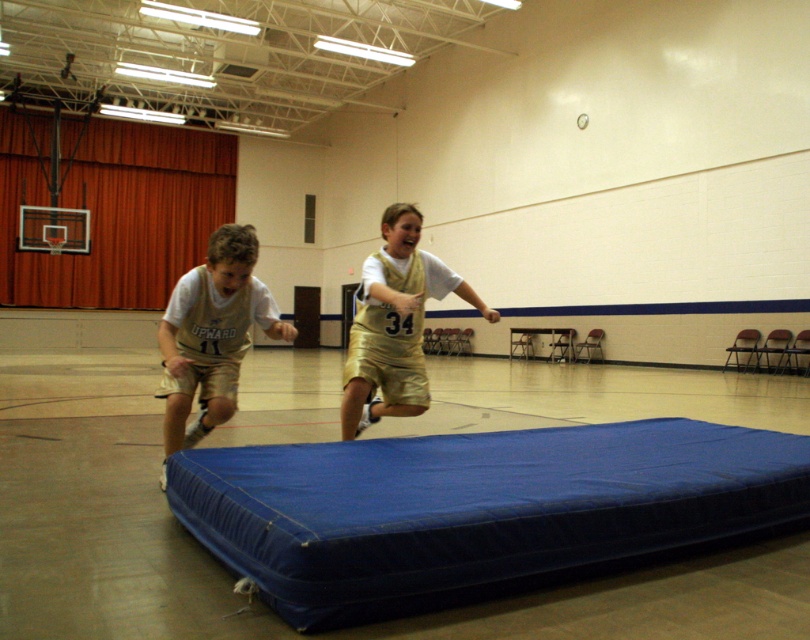
Question: Which of the following is the closest to the observer?

Choices:
 (A) (212, 372)
 (B) (372, 376)
 (C) (732, 496)

Answer: (C)

Question: Is blue fabric mattress at center below gold metallic shorts at center?

Choices:
 (A) no
 (B) yes

Answer: (B)

Question: Which point is farther to the camera?

Choices:
 (A) blue fabric mattress at center
 (B) gold metallic shorts at left

Answer: (B)

Question: Does gold metallic shorts at left appear under gold metallic shorts at center?

Choices:
 (A) yes
 (B) no

Answer: (A)

Question: Among these points, which one is nearest to the camera?

Choices:
 (A) (165, 342)
 (B) (399, 340)
 (C) (519, 474)

Answer: (C)

Question: Does blue fabric mattress at center come in front of gold metallic shorts at center?

Choices:
 (A) no
 (B) yes

Answer: (B)